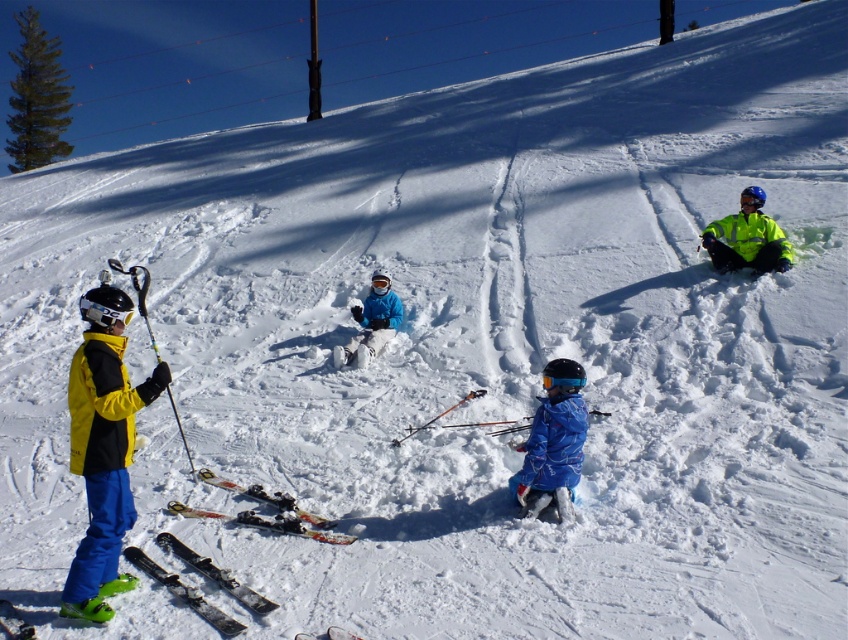
Question: Which of the following is the farthest from the observer?

Choices:
 (A) yellow matte jacket at left
 (B) blue matte jacket at center
 (C) matte black goggles at left
 (D) blue matte snowsuit at center

Answer: (B)

Question: Is black matte skis at lower left in front of matte black goggles at left?

Choices:
 (A) yes
 (B) no

Answer: (A)

Question: Can you confirm if yellow matte jacket at left is smaller than matte black goggles at left?

Choices:
 (A) no
 (B) yes

Answer: (A)

Question: Does neon yellow jacket at right appear on the right side of matte black goggles at left?

Choices:
 (A) no
 (B) yes

Answer: (B)

Question: Which of these objects is positioned farthest from the yellow matte jacket at left?

Choices:
 (A) matte black goggles at left
 (B) black matte skis at lower left

Answer: (A)

Question: Which object appears closest to the camera in this image?

Choices:
 (A) neon yellow jacket at right
 (B) yellow matte jacket at left
 (C) blue matte snowsuit at center

Answer: (B)